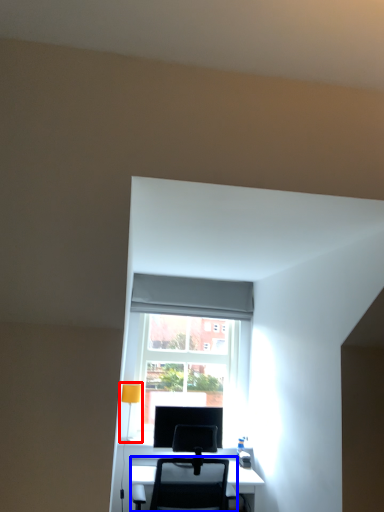
Question: Which object appears closest to the camera in this image, table lamp (highlighted by a red box) or chair (highlighted by a blue box)?

Choices:
 (A) table lamp
 (B) chair

Answer: (B)